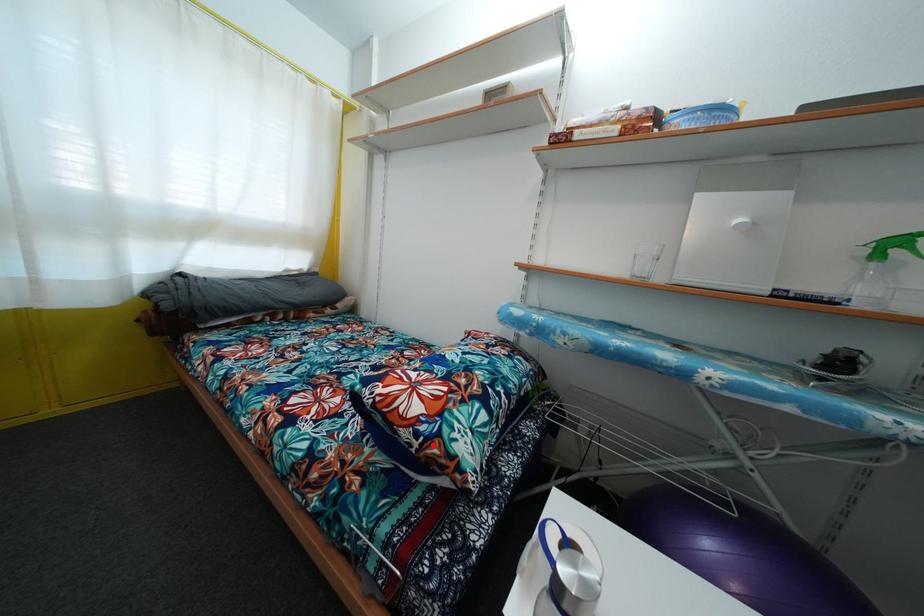
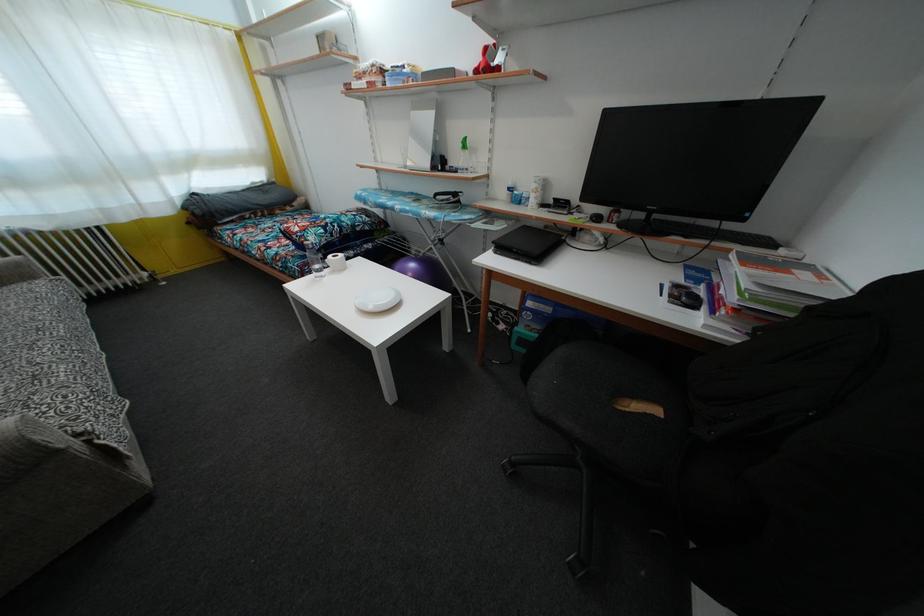
The point at the highlighted location is marked in the first image. Where is the corresponding point in the second image?

(305, 244)